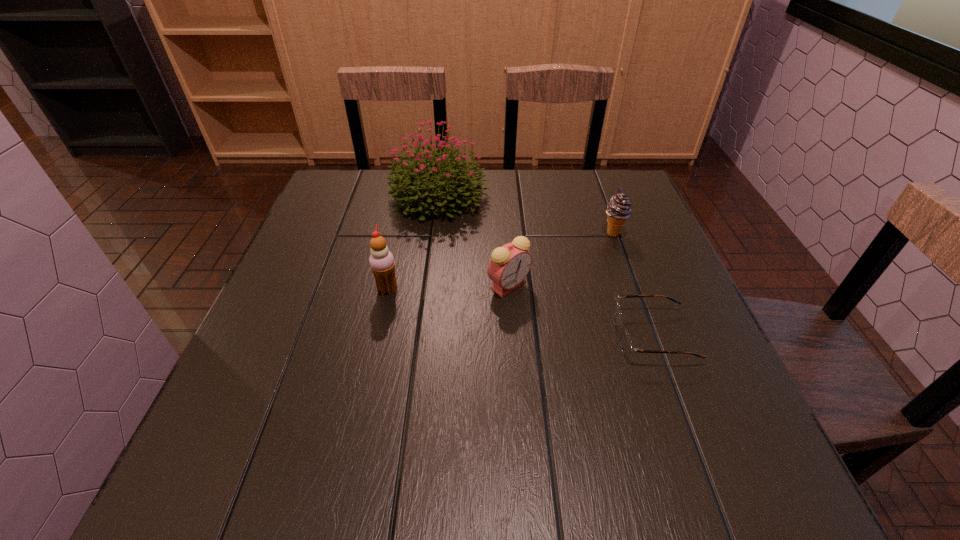
This screenshot has width=960, height=540. In the image, there is a desktop. What are the coordinates of `vacant space at the near edge` in the screenshot? It's located at (303, 454).

The width and height of the screenshot is (960, 540). Find the location of `free space at the left edge of the desktop`. free space at the left edge of the desktop is located at coordinates (308, 327).

Locate an element on the screen. vacant space at the right edge is located at coordinates (685, 346).

In the image, there is a desktop. Identify the location of vacant area at the far left corner. This screenshot has height=540, width=960. (x=332, y=212).

In the image, there is a desktop. Where is `vacant space at the far right corner`? The height and width of the screenshot is (540, 960). vacant space at the far right corner is located at coordinates (606, 198).

Locate an element on the screen. free space between the alarm clock and the farthest object is located at coordinates (474, 240).

Identify the location of empty location between the farther icecream and the alarm clock. (561, 259).

Find the location of a particular element. empty location between the shortest object and the second farthest object is located at coordinates (633, 285).

Locate an element on the screen. This screenshot has width=960, height=540. free space that is in between the shorter icecream and the alarm clock is located at coordinates (561, 259).

Where is `blank region between the alarm clock and the nearest object`? The width and height of the screenshot is (960, 540). blank region between the alarm clock and the nearest object is located at coordinates (581, 310).